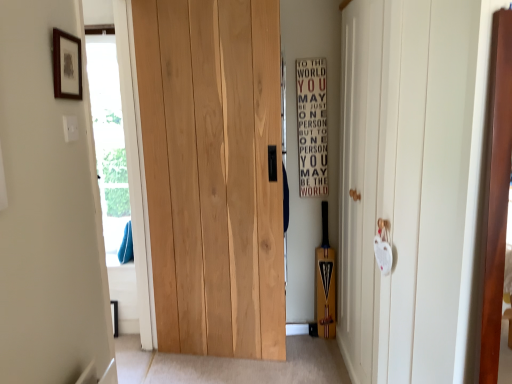
You are a GUI agent. You are given a task and a screenshot of the screen. Output one action in this format:
    pyautogui.click(x=<x>, y=<y>)
    Task: Click on the free point in front of natural wood door at center, which is the first door in left-to-right order
    This screenshot has height=384, width=512.
    Given the screenshot: What is the action you would take?
    [218, 374]